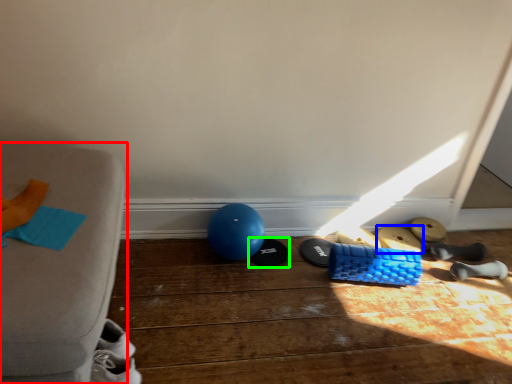
Question: Estimate the real-world distances between objects in this image. Which object is closer to furniture (highlighted by a red box), footwear (highlighted by a blue box) or footwear (highlighted by a green box)?

Choices:
 (A) footwear
 (B) footwear

Answer: (B)